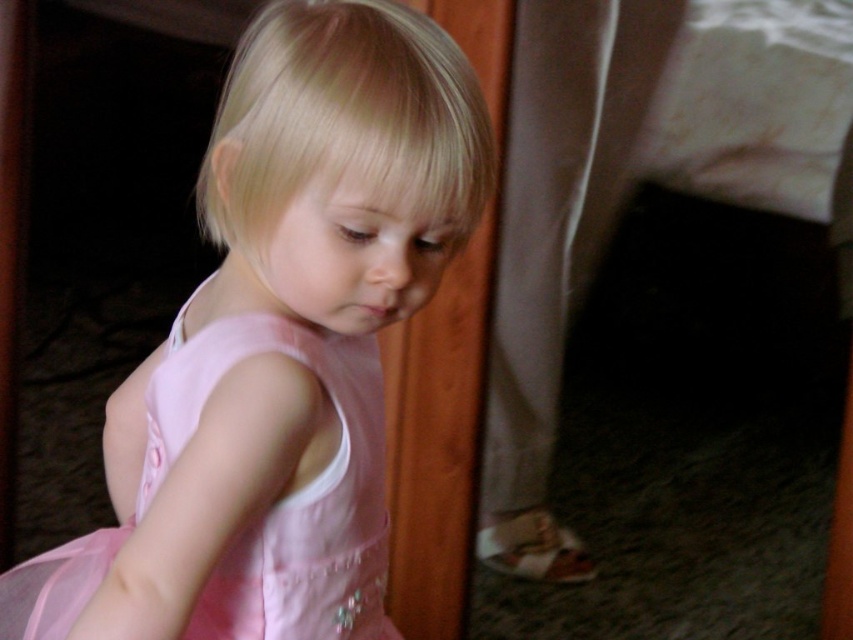
You are a photographer setting up a photoshoot in the room. You need to decide which dress to focus on first. Since both the pink satin dress at center and the pink tulle dress at center are in the same central area, which one is closer to you?

The pink satin dress at center is closer because it is in front of the pink tulle dress at center.